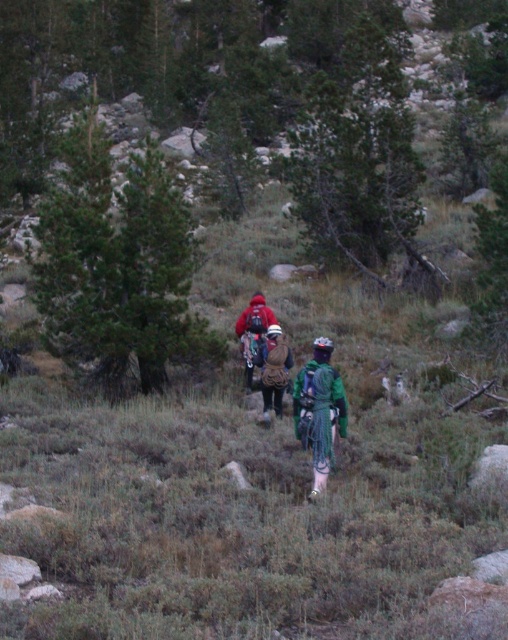
You are a hiker trying to locate your friend wearing a brown fuzzy jacket at center and another friend in a matte red jacket at center. Based on the scene, which friend is closer to you?

The brown fuzzy jacket at center is positioned under matte red jacket at center, so the brown fuzzy jacket at center is closer to you.

You are a hiker who needs to catch up with your friend who is 12.40 meters ahead of you. You are carrying the green fabric backpack at center. Can you estimate how far you need to walk to reach them?

You need to walk 12.40 meters to reach your friend since they are 12.40 meters ahead of you.

You are a hiker who needs to locate your green fabric backpack at center. Based on the scene description, can you determine its exact 2D coordinates?

The green fabric backpack at center is located at the 2D coordinates of point (320,410).